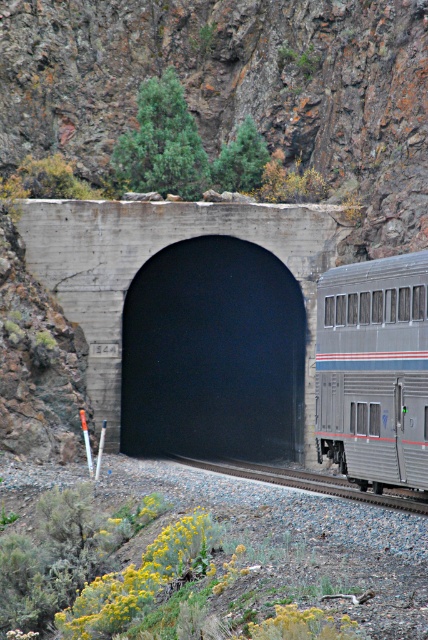
Question: From the image, what is the correct spatial relationship of black concrete tunnel at center in relation to metal train track at lower center?

Choices:
 (A) above
 (B) below

Answer: (A)

Question: Which of the following is the closest to the observer?

Choices:
 (A) silver metallic train car at center
 (B) metal train track at lower center
 (C) black concrete tunnel at center

Answer: (A)

Question: Which object is closer to the camera taking this photo?

Choices:
 (A) silver metallic train car at center
 (B) metal train track at lower center

Answer: (A)

Question: Which of these objects is positioned closest to the silver metallic train car at center?

Choices:
 (A) metal train track at lower center
 (B) black concrete tunnel at center

Answer: (A)

Question: Is the position of silver metallic train car at center less distant than that of metal train track at lower center?

Choices:
 (A) yes
 (B) no

Answer: (A)

Question: From the image, what is the correct spatial relationship of black concrete tunnel at center in relation to silver metallic train car at center?

Choices:
 (A) below
 (B) above

Answer: (A)